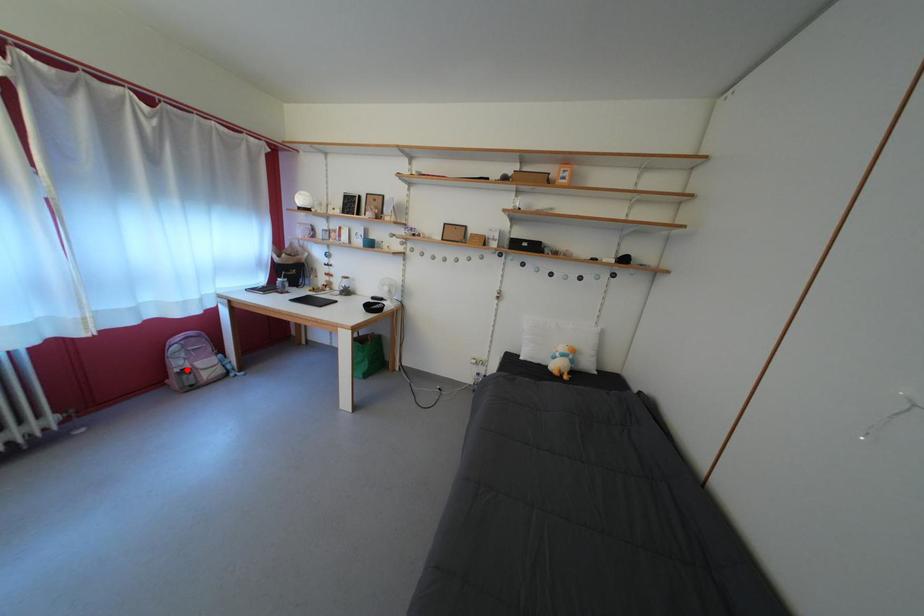
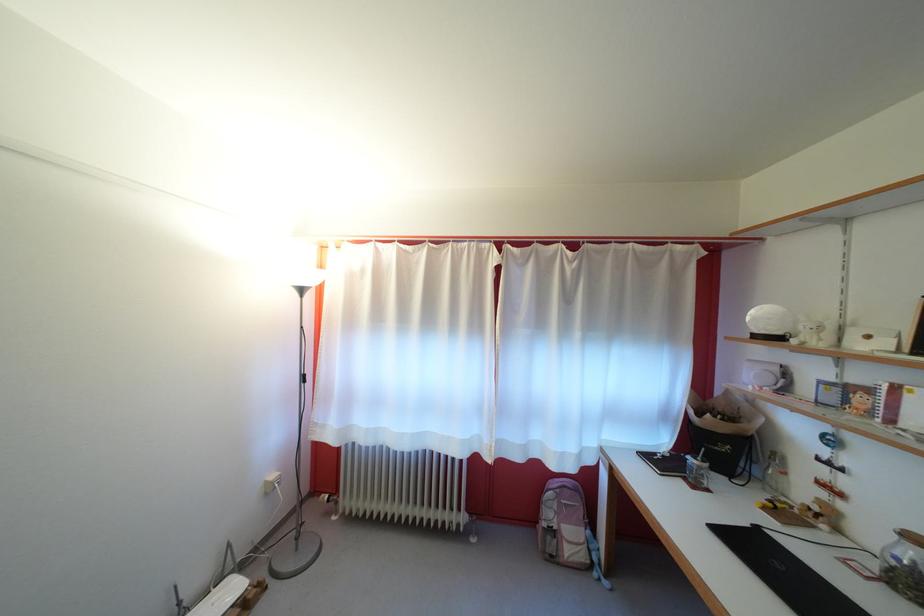
Question: I am providing you with two images of the same scene from different viewpoints. A red point is shown in image1. For the corresponding object point in image2, is it positioned nearer or farther from the camera?

Choices:
 (A) Nearer
 (B) Farther

Answer: (B)